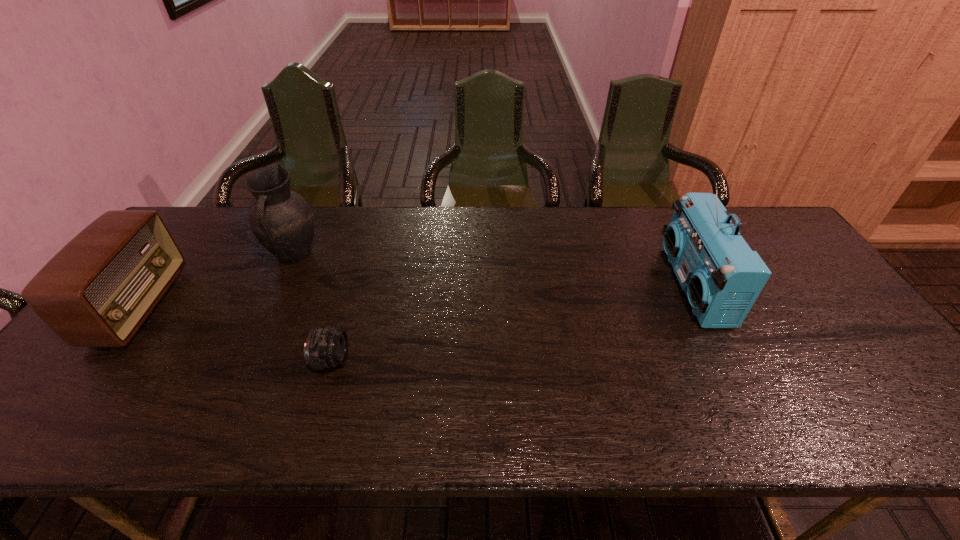
Find the location of a particular element. object that stands as the closest to the second object from right to left is located at coordinates (282, 220).

Locate which object ranks third in proximity to the pitcher. Please provide its 2D coordinates. Your answer should be formatted as a tuple, i.e. [(x, y)], where the tuple contains the x and y coordinates of a point satisfying the conditions above.

[(722, 277)]